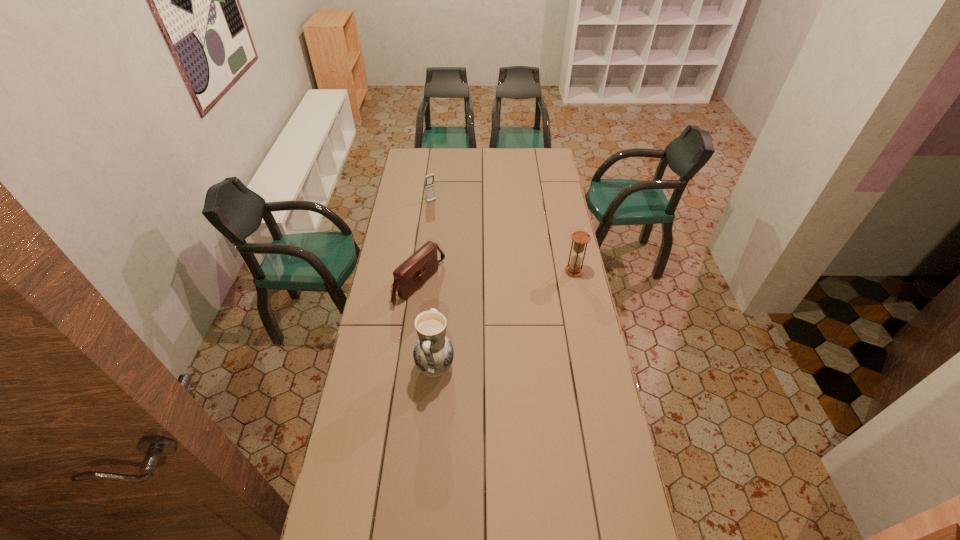
The width and height of the screenshot is (960, 540). I want to click on pottery, so click(433, 354).

Find the location of a particular element. the tallest object is located at coordinates (433, 354).

Identify the location of hourglass. The height and width of the screenshot is (540, 960). (580, 238).

Find the location of a particular element. This screenshot has height=540, width=960. the second tallest object is located at coordinates (580, 238).

The height and width of the screenshot is (540, 960). Find the location of `shoulder bag`. shoulder bag is located at coordinates (418, 268).

You are a GUI agent. You are given a task and a screenshot of the screen. Output one action in this format:
    pyautogui.click(x=<x>, y=<y>)
    Task: Click on the farthest object
    
    Given the screenshot: What is the action you would take?
    pyautogui.click(x=429, y=179)

Identify the location of free space located 0.100m on either side of the nearest object. (390, 367).

At what (x,y) coordinates should I click in order to perform the action: click on vacant space located on either side of the nearest object. Please return your answer as a coordinate pair (x, y). The width and height of the screenshot is (960, 540). Looking at the image, I should click on (364, 367).

You are a GUI agent. You are given a task and a screenshot of the screen. Output one action in this format:
    pyautogui.click(x=<x>, y=<y>)
    Task: Click on the vacant area located 0.110m on either side of the nearest object
    This screenshot has height=540, width=960.
    Given the screenshot: What is the action you would take?
    pyautogui.click(x=387, y=367)

I want to click on free point located 0.110m on the left of the rightmost object, so click(541, 271).